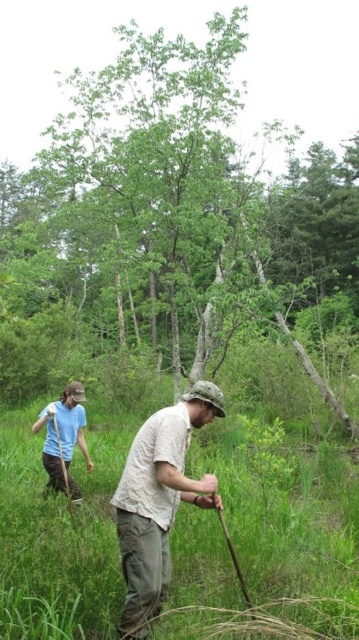
Is green grassy at center to the right of beige cotton shirt at center from the viewer's perspective?

Correct, you'll find green grassy at center to the right of beige cotton shirt at center.

Which is more to the right, green grassy at center or beige cotton shirt at center?

green grassy at center

In order to click on green grassy at center in this screenshot , I will do `click(58, 540)`.

Is point (133, 448) positioned before point (48, 436)?

Yes, point (133, 448) is in front of point (48, 436).

Is beige cotton shirt at center positioned in front of matte blue shirt at left?

Yes, beige cotton shirt at center is closer to the viewer.

The image size is (359, 640). What are the coordinates of `beige cotton shirt at center` in the screenshot? It's located at (159, 499).

Locate an element on the screen. This screenshot has width=359, height=640. beige cotton shirt at center is located at coordinates (159, 499).

Between green leafy tree at center and matte blue shirt at left, which one has more height?

With more height is green leafy tree at center.

Consider the image. Who is more distant from viewer, (x=101, y=244) or (x=70, y=426)?

The point (x=101, y=244) is more distant.

Find the location of `green leafy tree at center`. green leafy tree at center is located at coordinates (174, 212).